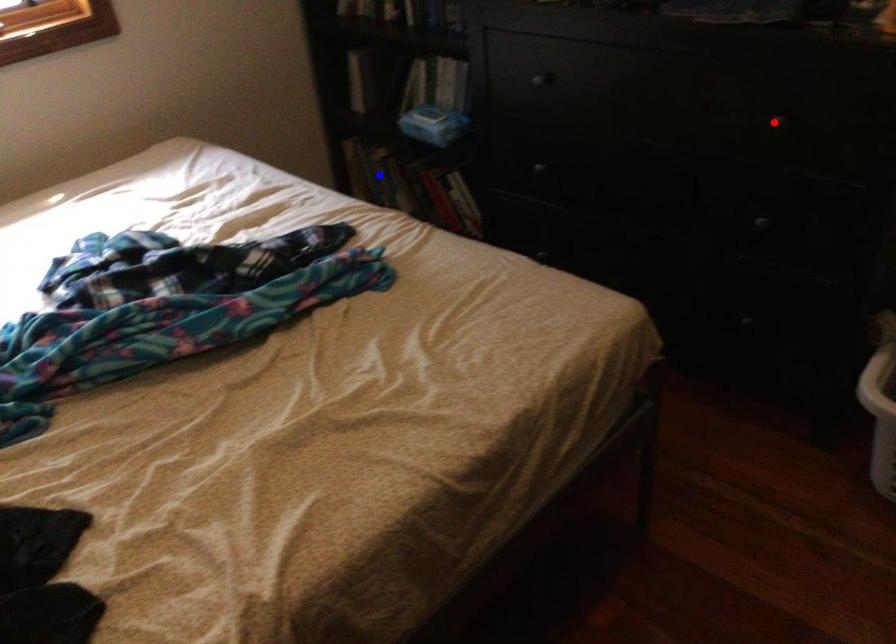
Question: Which of the two points in the image is closer to the camera?

Choices:
 (A) Blue point is closer.
 (B) Red point is closer.

Answer: (B)